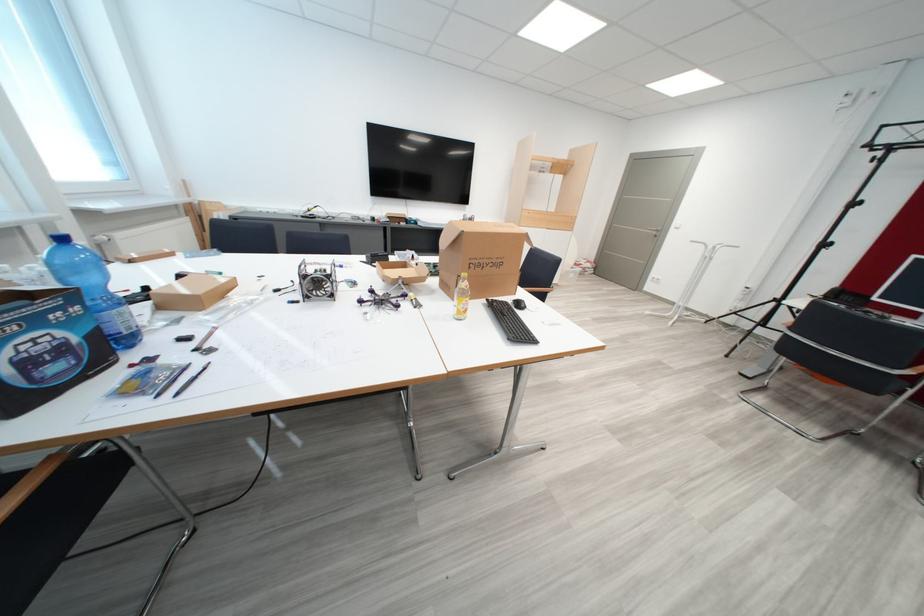
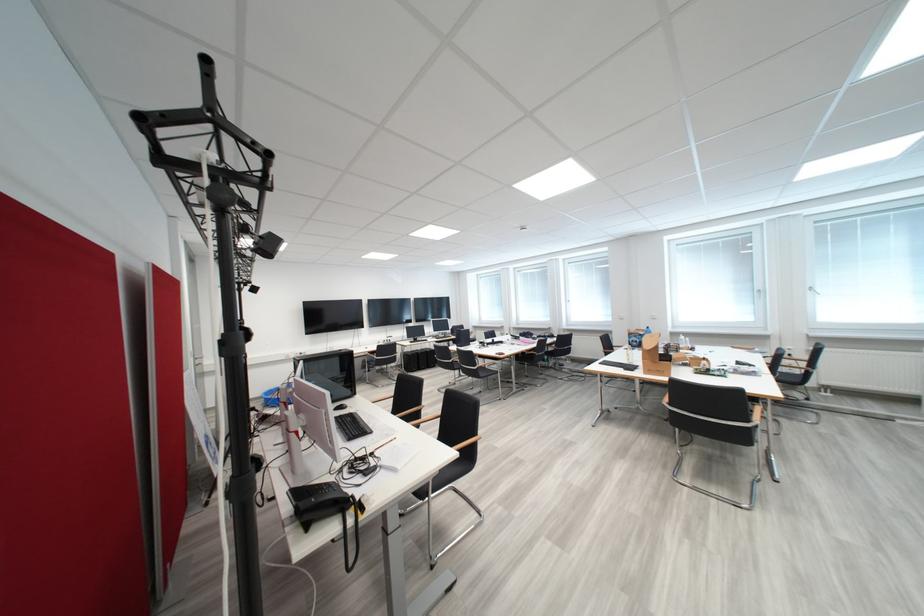
Question: I am providing you with two images of the same scene from different viewpoints. After the viewpoint changes to image2, which objects are now occluded?

Choices:
 (A) telephone handset
 (B) chrome chair armrest
 (C) small white figurine
 (D) water bottle

Answer: (B)